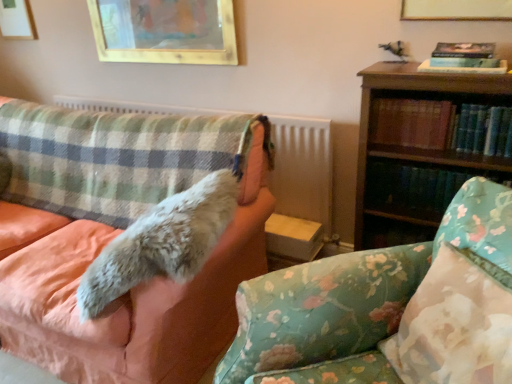
Question: Considering the relative sizes of hardcover book at right, the second book when ordered from top to bottom, and floral fabric pillow at lower right in the image provided, is hardcover book at right, the second book when ordered from top to bottom, thinner than floral fabric pillow at lower right?

Choices:
 (A) no
 (B) yes

Answer: (B)

Question: Is hardcover book at right, which appears as the second book when ordered from the bottom, smaller than floral fabric pillow at lower right?

Choices:
 (A) yes
 (B) no

Answer: (A)

Question: From the image's perspective, does hardcover book at right, which appears as the second book when ordered from the bottom, appear higher than floral fabric pillow at lower right?

Choices:
 (A) yes
 (B) no

Answer: (A)

Question: From a real-world perspective, is hardcover book at right, the second book when ordered from top to bottom, beneath floral fabric pillow at lower right?

Choices:
 (A) yes
 (B) no

Answer: (B)

Question: Does hardcover book at right, the second book when ordered from top to bottom, have a greater height compared to floral fabric pillow at lower right?

Choices:
 (A) no
 (B) yes

Answer: (A)

Question: From a real-world perspective, is hardcover book at right, the second book when ordered from top to bottom, located higher than floral fabric pillow at lower right?

Choices:
 (A) no
 (B) yes

Answer: (B)

Question: Is gold-framed picture at upper center, the 2th picture frame when ordered from right to left, positioned with its back to plaid fabric radiator at left?

Choices:
 (A) yes
 (B) no

Answer: (B)

Question: Is gold-framed picture at upper center, the 2th picture frame when ordered from back to front, not close to plaid fabric radiator at left?

Choices:
 (A) yes
 (B) no

Answer: (B)

Question: Is gold-framed picture at upper center, the second picture frame viewed from the left, further to camera compared to plaid fabric radiator at left?

Choices:
 (A) yes
 (B) no

Answer: (A)

Question: Is gold-framed picture at upper center, the 2th picture frame in the front-to-back sequence, smaller than plaid fabric radiator at left?

Choices:
 (A) yes
 (B) no

Answer: (A)

Question: From a real-world perspective, is gold-framed picture at upper center, the second picture frame viewed from the left, on top of plaid fabric radiator at left?

Choices:
 (A) yes
 (B) no

Answer: (A)

Question: Considering the relative sizes of gold-framed picture at upper center, the 2th picture frame when ordered from right to left, and plaid fabric radiator at left in the image provided, is gold-framed picture at upper center, the 2th picture frame when ordered from right to left, shorter than plaid fabric radiator at left?

Choices:
 (A) no
 (B) yes

Answer: (B)

Question: From the image's perspective, would you say wooden picture frame at upper left, the first picture frame viewed from the back, is shown under fluffy white fur at left?

Choices:
 (A) yes
 (B) no

Answer: (B)